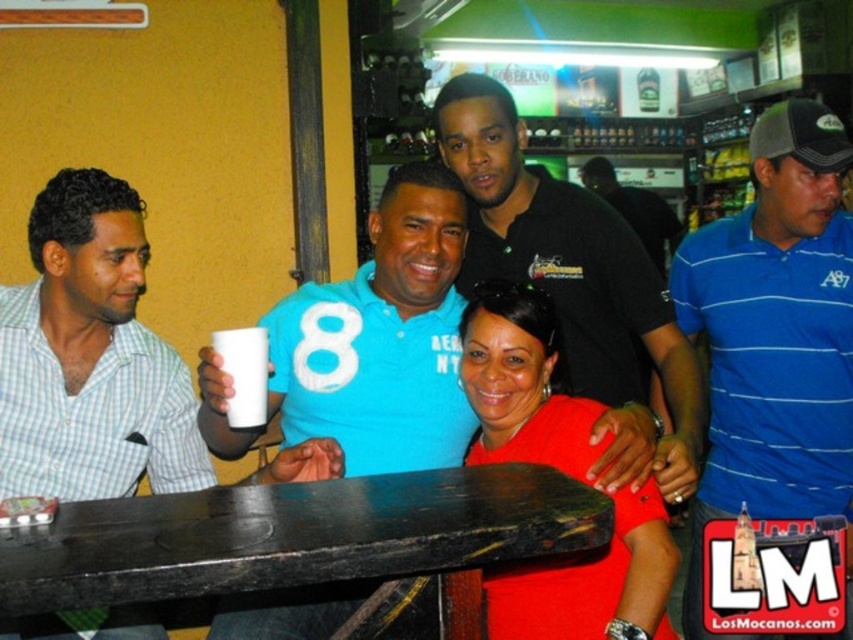
Question: Which point is farther from the camera taking this photo?

Choices:
 (A) (834, 195)
 (B) (276, 518)
 (C) (552, 202)
 (D) (331, 336)

Answer: (C)

Question: Estimate the real-world distances between objects in this image. Which object is closer to the blue striped polo shirt at center?

Choices:
 (A) black matte table at center
 (B) black shirt at center
 (C) matte black shirt at center
 (D) white matte number at center

Answer: (D)

Question: Is blue striped polo shirt at center in front of black shirt at center?

Choices:
 (A) yes
 (B) no

Answer: (B)

Question: Which object is the farthest from the matte black shirt at center?

Choices:
 (A) blue striped polo shirt at center
 (B) white matte number at center
 (C) white fabric number at center
 (D) black matte table at center

Answer: (D)

Question: Is black matte table at center smaller than blue striped polo shirt at center?

Choices:
 (A) yes
 (B) no

Answer: (A)

Question: Is black matte table at center above black shirt at center?

Choices:
 (A) no
 (B) yes

Answer: (A)